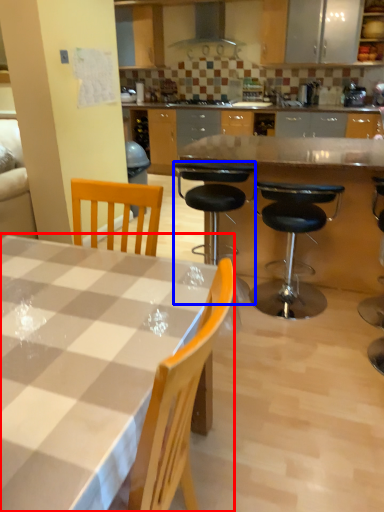
Question: Which of the following is the closest to the observer, kitchen & dining room table (highlighted by a red box) or chair (highlighted by a blue box)?

Choices:
 (A) kitchen & dining room table
 (B) chair

Answer: (A)